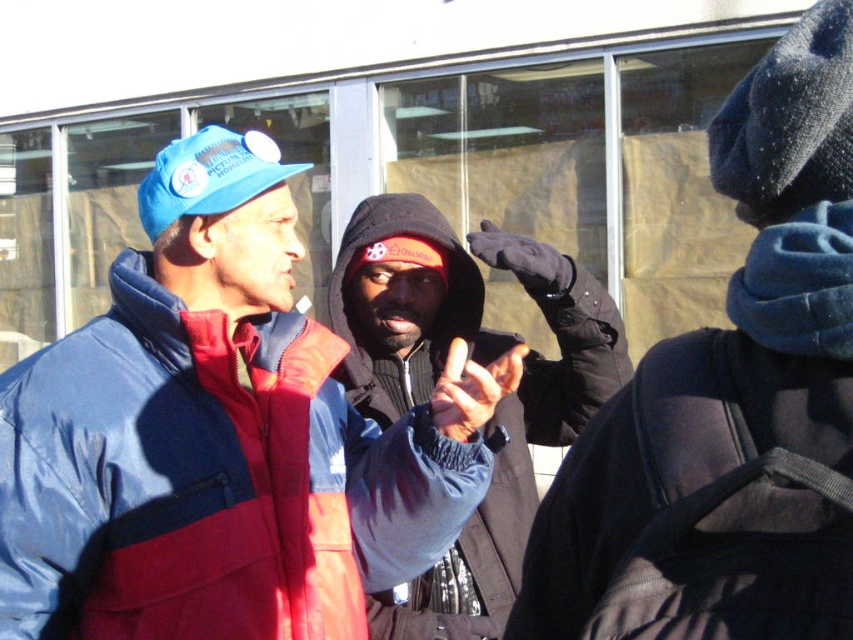
Question: Among these objects, which one is farthest from the camera?

Choices:
 (A) dark blue fleece jacket at center
 (B) dark blue jacket at center
 (C) black synthetic jacket at lower right

Answer: (A)

Question: Is dark blue jacket at center further to the viewer compared to black synthetic jacket at lower right?

Choices:
 (A) yes
 (B) no

Answer: (B)

Question: Does dark blue jacket at center appear on the right side of black synthetic jacket at lower right?

Choices:
 (A) no
 (B) yes

Answer: (B)

Question: Considering the relative positions of blue fleece jacket at center and dark blue jacket at center in the image provided, where is blue fleece jacket at center located with respect to dark blue jacket at center?

Choices:
 (A) below
 (B) above

Answer: (A)

Question: Which of the following is the closest to the observer?

Choices:
 (A) black synthetic jacket at lower right
 (B) dark blue fleece jacket at center

Answer: (A)

Question: Which point is closer to the camera?

Choices:
 (A) black synthetic jacket at lower right
 (B) matte blue cap at upper left

Answer: (A)